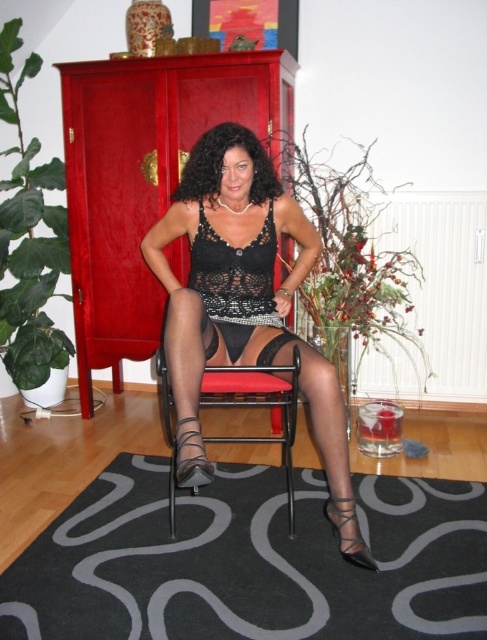
Can you confirm if black lace lingerie at center is shorter than black lace dress at center?

No, black lace lingerie at center is not shorter than black lace dress at center.

Does black lace lingerie at center appear on the right side of black lace dress at center?

Correct, you'll find black lace lingerie at center to the right of black lace dress at center.

Does point (258, 360) lie behind point (259, 273)?

No, it is not.

This screenshot has height=640, width=487. Identify the location of black lace lingerie at center. (238, 292).

Is black lace lingerie at center shorter than black sheer stocking at lower center?

No.

In the scene shown: Between black lace lingerie at center and black sheer stocking at lower center, which one has more height?

black lace lingerie at center is taller.

Does point (222, 230) lie behind point (349, 499)?

Yes.

Where is `black lace lingerie at center`? black lace lingerie at center is located at coordinates (238, 292).

Does black lace dress at center have a smaller size compared to black sheer stocking at lower center?

No, black lace dress at center is not smaller than black sheer stocking at lower center.

Between point (232, 275) and point (339, 513), which one is positioned in front?

Point (339, 513)

Where is `black lace dress at center`? This screenshot has width=487, height=640. black lace dress at center is located at coordinates (235, 282).